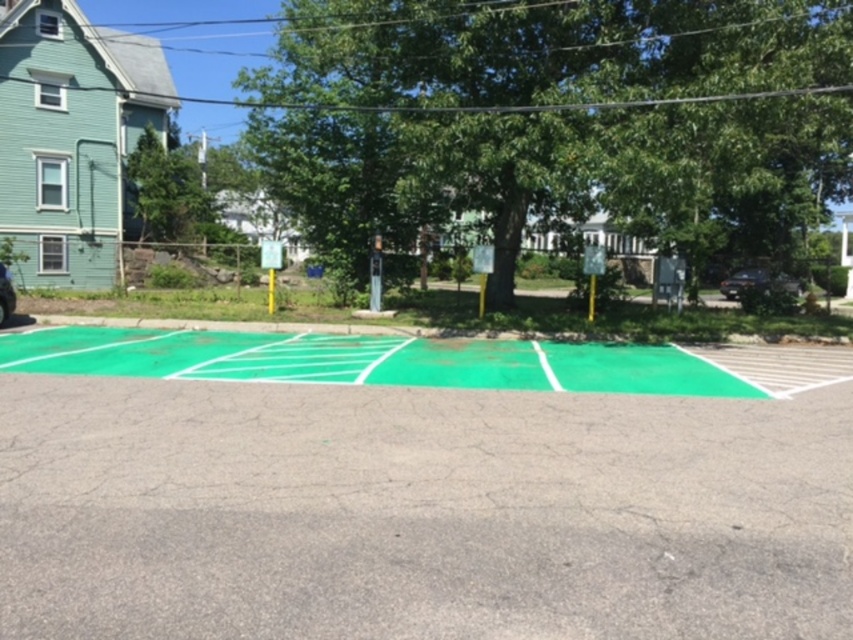
Which is in front, point (759, 278) or point (9, 252)?

Positioned in front is point (759, 278).

Is shiny black car at right thinner than shiny blue car at left?

Yes, shiny black car at right is thinner than shiny blue car at left.

Where is `shiny black car at right`? shiny black car at right is located at coordinates (757, 282).

Identify the location of shiny black car at right. (757, 282).

Can you confirm if green painted court at center is taller than shiny blue car at left?

No.

Who is more distant from viewer, (x=245, y=515) or (x=6, y=257)?

Point (x=6, y=257)

This screenshot has width=853, height=640. In order to click on green painted court at center in this screenshot , I will do `click(419, 488)`.

Is green leafy tree at center positioned before shiny black car at right?

Yes, it is.

You are a GUI agent. You are given a task and a screenshot of the screen. Output one action in this format:
    pyautogui.click(x=<x>, y=<y>)
    Task: Click on the green leafy tree at center
    The height and width of the screenshot is (640, 853).
    Given the screenshot: What is the action you would take?
    pyautogui.click(x=556, y=115)